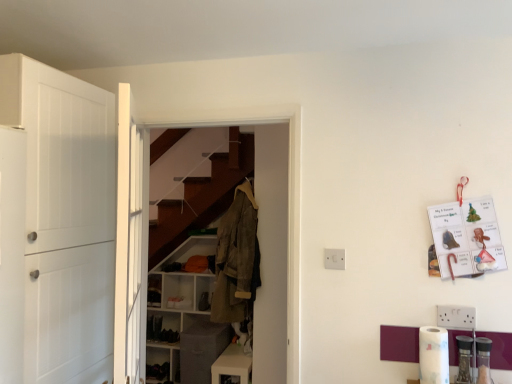
Question: Is white matte door at left, which appears as the second door when viewed from the right, completely or partially outside of white glossy cabinet at lower center, marked as the first cabinetry in a front-to-back arrangement?

Choices:
 (A) yes
 (B) no

Answer: (A)

Question: From the image's perspective, is white matte door at left, placed as the 1th door when sorted from left to right, on top of white glossy cabinet at lower center, which is the first cabinetry in right-to-left order?

Choices:
 (A) yes
 (B) no

Answer: (A)

Question: Is white matte door at left, placed as the 1th door when sorted from left to right, shorter than white glossy cabinet at lower center, positioned as the second cabinetry in back-to-front order?

Choices:
 (A) no
 (B) yes

Answer: (A)

Question: Considering the relative positions of white matte door at left, placed as the 1th door when sorted from left to right, and white glossy cabinet at lower center, which is the first cabinetry in right-to-left order, in the image provided, is white matte door at left, placed as the 1th door when sorted from left to right, to the right of white glossy cabinet at lower center, which is the first cabinetry in right-to-left order, from the viewer's perspective?

Choices:
 (A) no
 (B) yes

Answer: (A)

Question: Is white matte door at left, which appears as the second door when viewed from the right, oriented towards white glossy cabinet at lower center, positioned as the second cabinetry in back-to-front order?

Choices:
 (A) yes
 (B) no

Answer: (B)

Question: In the image, is white plastic electric outlet at center on the left side or the right side of khaki cotton jacket at center?

Choices:
 (A) left
 (B) right

Answer: (B)

Question: Is white plastic electric outlet at center bigger or smaller than khaki cotton jacket at center?

Choices:
 (A) big
 (B) small

Answer: (B)

Question: Is point (334, 254) closer or farther from the camera than point (244, 228)?

Choices:
 (A) farther
 (B) closer

Answer: (B)

Question: From a real-world perspective, is white plastic electric outlet at center above or below khaki cotton jacket at center?

Choices:
 (A) below
 (B) above

Answer: (B)

Question: Based on their sizes in the image, would you say white glossy cabinet at lower center, which is the first cabinetry in right-to-left order, is bigger or smaller than white matte cabinet at center, the first cabinetry from the left?

Choices:
 (A) big
 (B) small

Answer: (B)

Question: Considering the positions of point (223, 360) and point (188, 283), is point (223, 360) closer or farther from the camera than point (188, 283)?

Choices:
 (A) closer
 (B) farther

Answer: (A)

Question: In terms of width, does white glossy cabinet at lower center, positioned as the second cabinetry in back-to-front order, look wider or thinner when compared to white matte cabinet at center, the 1th cabinetry positioned from the back?

Choices:
 (A) wide
 (B) thin

Answer: (B)

Question: Is white glossy cabinet at lower center, the 2th cabinetry from the left, in front of or behind white matte cabinet at center, the second cabinetry viewed from the right, in the image?

Choices:
 (A) behind
 (B) front

Answer: (B)

Question: Considering the positions of khaki cotton jacket at center and white glossy cabinet at lower center, positioned as the second cabinetry in back-to-front order, in the image, is khaki cotton jacket at center wider or thinner than white glossy cabinet at lower center, positioned as the second cabinetry in back-to-front order,?

Choices:
 (A) thin
 (B) wide

Answer: (B)

Question: Visually, is khaki cotton jacket at center positioned to the left or to the right of white glossy cabinet at lower center, which is the first cabinetry in right-to-left order?

Choices:
 (A) left
 (B) right

Answer: (A)